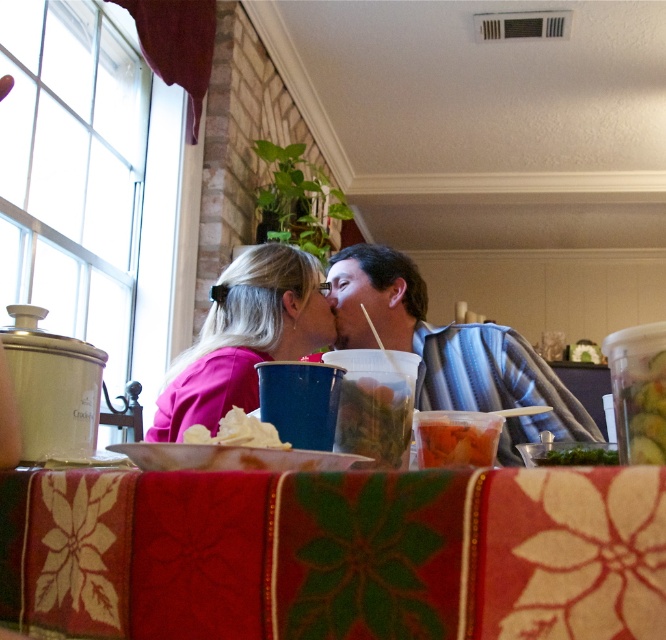
Question: Does christmas-patterned fabric at lower center appear under translucent plastic container at center?

Choices:
 (A) yes
 (B) no

Answer: (A)

Question: Which of the following is the closest to the observer?

Choices:
 (A) (234, 432)
 (B) (533, 458)

Answer: (A)

Question: Can you confirm if pink matte shirt at center is smaller than green leafy vegetable at center?

Choices:
 (A) no
 (B) yes

Answer: (A)

Question: Which object is farther from the camera taking this photo?

Choices:
 (A) smooth blue shirt at center
 (B) green leafy vegetable at center
 (C) white crumpled paper at center
 (D) pink matte shirt at center

Answer: (D)

Question: In this image, where is christmas-patterned fabric at lower center located relative to translucent plastic container at center?

Choices:
 (A) right
 (B) left

Answer: (B)

Question: Which object is the closest to the translucent plastic container at center?

Choices:
 (A) white crumpled paper at center
 (B) smooth blue shirt at center
 (C) green leafy vegetable at center
 (D) christmas-patterned fabric at lower center

Answer: (C)